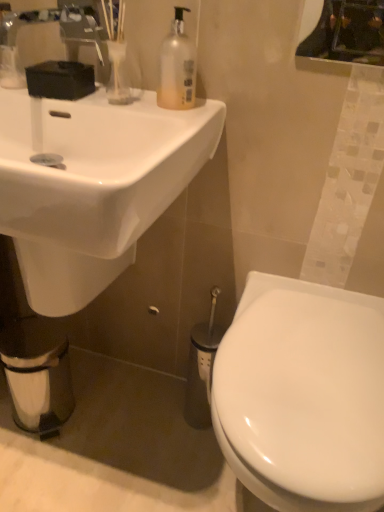
What is the approximate height of metallic reflective mirror at upper right?

The height of metallic reflective mirror at upper right is 6.88 inches.

The width and height of the screenshot is (384, 512). What are the coordinates of `white matte toilet paper at lower left` in the screenshot? It's located at (37, 374).

Describe the element at coordinates (303, 395) in the screenshot. The width and height of the screenshot is (384, 512). I see `white glossy toilet at lower right` at that location.

You are a GUI agent. You are given a task and a screenshot of the screen. Output one action in this format:
    pyautogui.click(x=<x>, y=<y>)
    Task: Click on the white glossy toilet at lower right
    
    Given the screenshot: What is the action you would take?
    pyautogui.click(x=303, y=395)

What is the approximate height of translucent plastic soap dispenser at upper center?

It is 7.17 inches.

The height and width of the screenshot is (512, 384). I want to click on metallic reflective mirror at upper right, so click(x=348, y=32).

Which is in front, point (343, 26) or point (188, 75)?

The point (343, 26) is more forward.

Considering the relative sizes of metallic reflective mirror at upper right and translucent plastic soap dispenser at upper center in the image provided, is metallic reflective mirror at upper right bigger than translucent plastic soap dispenser at upper center?

Yes.

Identify the location of mirror in front of the translucent plastic soap dispenser at upper center. (348, 32).

Is metallic reflective mirror at upper right next to translucent plastic soap dispenser at upper center and touching it?

metallic reflective mirror at upper right and translucent plastic soap dispenser at upper center are not in contact.

How far apart are white glossy toilet at lower right and metallic reflective mirror at upper right?

22.10 inches.

From a real-world perspective, is white glossy toilet at lower right above or below metallic reflective mirror at upper right?

white glossy toilet at lower right is below metallic reflective mirror at upper right.

From the image's perspective, is white glossy toilet at lower right located above or below metallic reflective mirror at upper right?

white glossy toilet at lower right is below metallic reflective mirror at upper right.

Is white glossy toilet at lower right looking in the opposite direction of metallic reflective mirror at upper right?

white glossy toilet at lower right is not turned away from metallic reflective mirror at upper right.

Between translucent plastic soap dispenser at upper center and metallic reflective mirror at upper right, which one has larger size?

With larger size is metallic reflective mirror at upper right.

From a real-world perspective, is translucent plastic soap dispenser at upper center positioned above or below metallic reflective mirror at upper right?

translucent plastic soap dispenser at upper center is situated lower than metallic reflective mirror at upper right in the real world.

At what (x,y) coordinates should I click in order to perform the action: click on bottle lying behind the metallic reflective mirror at upper right. Please return your answer as a coordinate pair (x, y). The image size is (384, 512). Looking at the image, I should click on (177, 67).

Considering the positions of points (366, 14) and (119, 179), is point (366, 14) closer to camera compared to point (119, 179)?

Yes.

From the image's perspective, which object appears higher, metallic reflective mirror at upper right or white glossy sink at upper left?

metallic reflective mirror at upper right appears higher in the image.

I want to click on mirror that appears behind the white glossy sink at upper left, so click(x=348, y=32).

Does metallic reflective mirror at upper right appear on the right side of white glossy toilet at lower right?

Correct, you'll find metallic reflective mirror at upper right to the right of white glossy toilet at lower right.

Between metallic reflective mirror at upper right and white glossy toilet at lower right, which one is positioned behind?

metallic reflective mirror at upper right is more distant.

Considering the relative sizes of metallic reflective mirror at upper right and white glossy toilet at lower right in the image provided, is metallic reflective mirror at upper right thinner than white glossy toilet at lower right?

Indeed, metallic reflective mirror at upper right has a lesser width compared to white glossy toilet at lower right.

Can you tell me how much metallic reflective mirror at upper right and white glossy toilet at lower right differ in facing direction?

The angle between the facing direction of metallic reflective mirror at upper right and the facing direction of white glossy toilet at lower right is 1.99 degrees.

Is white glossy toilet at lower right further to the viewer compared to white matte toilet paper at lower left?

No, white glossy toilet at lower right is closer to the viewer.

Can you confirm if white glossy toilet at lower right is positioned to the left of white matte toilet paper at lower left?

Incorrect, white glossy toilet at lower right is not on the left side of white matte toilet paper at lower left.

How different are the orientations of white glossy toilet at lower right and white matte toilet paper at lower left in degrees?

The facing directions of white glossy toilet at lower right and white matte toilet paper at lower left are 13.4 degrees apart.

Can you confirm if white glossy toilet at lower right is smaller than white matte toilet paper at lower left?

No.

Is the depth of white glossy sink at upper left greater than that of metallic reflective mirror at upper right?

No, white glossy sink at upper left is closer to the camera.

From a real-world perspective, who is located lower, white glossy sink at upper left or metallic reflective mirror at upper right?

In real-world perspective, white glossy sink at upper left is lower.

Is the surface of white glossy sink at upper left in direct contact with metallic reflective mirror at upper right?

white glossy sink at upper left and metallic reflective mirror at upper right are clearly separated.

Locate an element on the screen. Image resolution: width=384 pixels, height=512 pixels. mirror above the translucent plastic soap dispenser at upper center (from the image's perspective) is located at coordinates (348, 32).

This screenshot has height=512, width=384. In order to click on mirror behind the white glossy toilet at lower right in this screenshot , I will do `click(348, 32)`.

From the image, which object appears to be nearer to translucent plastic soap dispenser at upper center, metallic reflective mirror at upper right or white matte toilet paper at lower left?

Based on the image, metallic reflective mirror at upper right appears to be nearer to translucent plastic soap dispenser at upper center.

From the image, which object appears to be nearer to white glossy sink at upper left, white glossy toilet at lower right or white matte toilet paper at lower left?

white matte toilet paper at lower left is positioned closer to the anchor white glossy sink at upper left.

When comparing their distances from translucent plastic soap dispenser at upper center, does white glossy sink at upper left or metallic reflective mirror at upper right seem further?

The object further to translucent plastic soap dispenser at upper center is metallic reflective mirror at upper right.

Looking at the image, which one is located closer to white matte toilet paper at lower left, metallic reflective mirror at upper right or white glossy toilet at lower right?

Among the two, white glossy toilet at lower right is located nearer to white matte toilet paper at lower left.

Estimate the real-world distances between objects in this image. Which object is closer to white glossy sink at upper left, metallic reflective mirror at upper right or white matte toilet paper at lower left?

white matte toilet paper at lower left lies closer to white glossy sink at upper left than the other object.

Estimate the real-world distances between objects in this image. Which object is further from white glossy sink at upper left, metallic reflective mirror at upper right or white glossy toilet at lower right?

Among the two, metallic reflective mirror at upper right is located further to white glossy sink at upper left.

When comparing their distances from translucent plastic soap dispenser at upper center, does white matte toilet paper at lower left or metallic reflective mirror at upper right seem closer?

metallic reflective mirror at upper right.

From the image, which object appears to be farther from translucent plastic soap dispenser at upper center, white glossy toilet at lower right or white glossy sink at upper left?

white glossy toilet at lower right is further to translucent plastic soap dispenser at upper center.

Identify the location of sink that lies between metallic reflective mirror at upper right and white glossy toilet at lower right from top to bottom. (92, 186).

Where is `sink between translucent plastic soap dispenser at upper center and white glossy toilet at lower right in the up-down direction`? sink between translucent plastic soap dispenser at upper center and white glossy toilet at lower right in the up-down direction is located at coordinates (92, 186).

Identify the location of bottle between metallic reflective mirror at upper right and white matte toilet paper at lower left in the vertical direction. (177, 67).

You are a GUI agent. You are given a task and a screenshot of the screen. Output one action in this format:
    pyautogui.click(x=<x>, y=<y>)
    Task: Click on the toilet paper between metallic reflective mirror at upper right and white glossy toilet at lower right in the vertical direction
    The width and height of the screenshot is (384, 512).
    Given the screenshot: What is the action you would take?
    pyautogui.click(x=37, y=374)